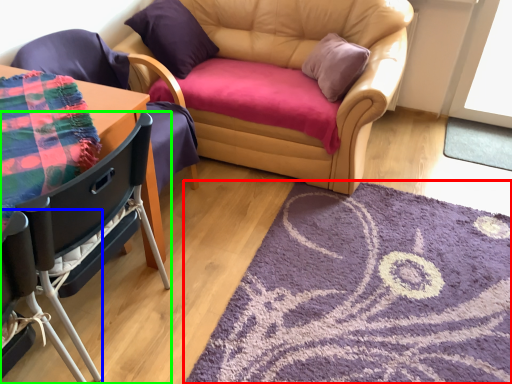
Question: Considering the real-world distances, which object is closest to mat (highlighted by a red box)? chair (highlighted by a blue box) or chair (highlighted by a green box).

Choices:
 (A) chair
 (B) chair

Answer: (B)